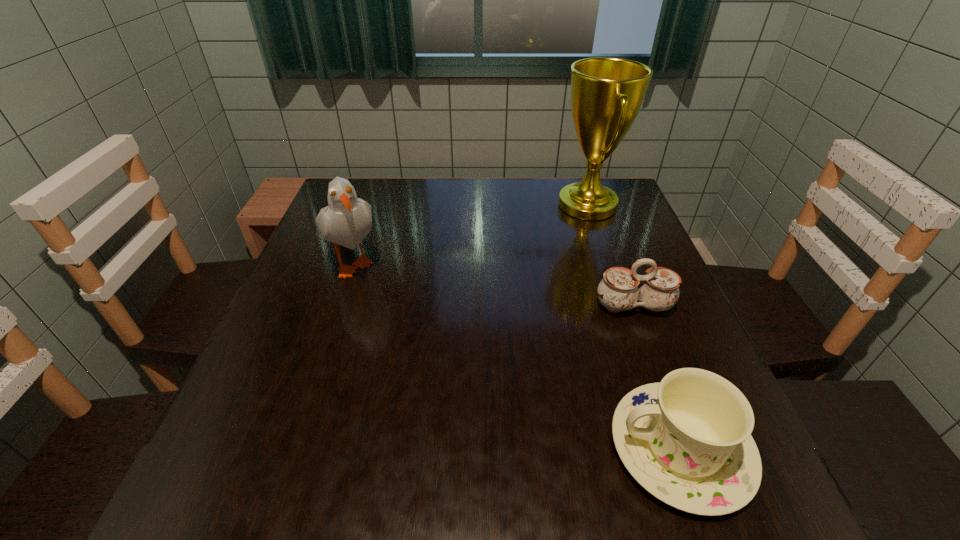
The image size is (960, 540). I want to click on the tallest object, so click(607, 93).

This screenshot has width=960, height=540. In order to click on the second tallest object in this screenshot , I will do `click(347, 220)`.

Where is `gull`? The height and width of the screenshot is (540, 960). gull is located at coordinates (347, 220).

This screenshot has height=540, width=960. I want to click on the farther chinaware, so click(x=620, y=289).

The image size is (960, 540). In order to click on the nearer chinaware in this screenshot , I will do `click(687, 440)`.

At what (x,y) coordinates should I click in order to perform the action: click on vacant space located by the handles of the tallest object. Please return your answer as a coordinate pair (x, y). The width and height of the screenshot is (960, 540). Looking at the image, I should click on (419, 205).

Where is `free space located 0.060m by the handles of the tallest object`? The height and width of the screenshot is (540, 960). free space located 0.060m by the handles of the tallest object is located at coordinates (534, 205).

Where is `free region located 0.110m by the handles of the tallest object`? free region located 0.110m by the handles of the tallest object is located at coordinates (516, 205).

In order to click on vacant space positioned at the beak of the third shortest object in this screenshot , I will do [313, 381].

At what (x,y) coordinates should I click in order to perform the action: click on vacant space located 0.150m by the handle of the farther chinaware. Please return your answer as a coordinate pair (x, y). Looking at the image, I should click on (661, 381).